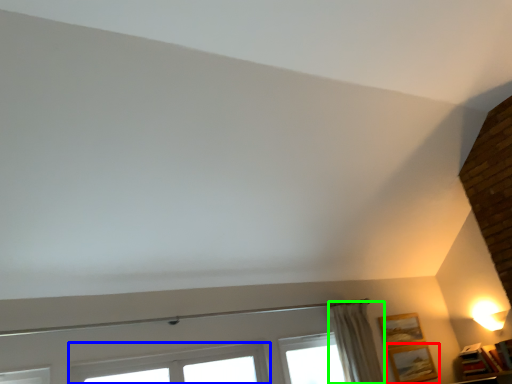
Question: Estimate the real-world distances between objects in this image. Which object is closer to picture frame (highlighted by a red box), window (highlighted by a blue box) or curtain (highlighted by a green box)?

Choices:
 (A) window
 (B) curtain

Answer: (B)